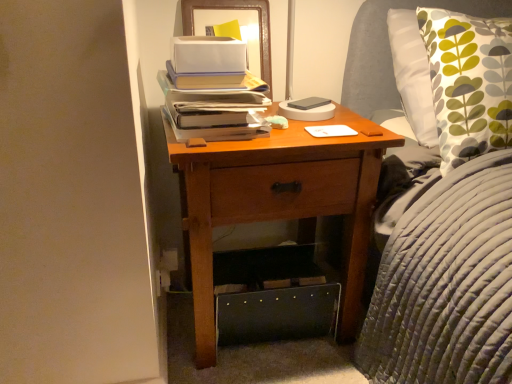
The image size is (512, 384). What do you see at coordinates (330, 131) in the screenshot?
I see `white matte notepad at center` at bounding box center [330, 131].

This screenshot has width=512, height=384. What do you see at coordinates (279, 202) in the screenshot?
I see `wooden nightstand at center` at bounding box center [279, 202].

The height and width of the screenshot is (384, 512). Find the location of `wooden nightstand at center`. wooden nightstand at center is located at coordinates (279, 202).

Find the location of a particular element. matte paper stack of books at center is located at coordinates (215, 108).

The image size is (512, 384). I want to click on white matte notepad at center, so click(330, 131).

Locate an element on the screen. picture frame on the right side of matte paper stack of books at center is located at coordinates (230, 19).

In the scene shown: Is wooden framed picture at upper center to the left or to the right of matte paper stack of books at center in the image?

From the image, it's evident that wooden framed picture at upper center is to the right of matte paper stack of books at center.

Which of these two, wooden framed picture at upper center or matte paper stack of books at center, is bigger?

With larger size is matte paper stack of books at center.

From the image's perspective, is wooden framed picture at upper center positioned above or below matte paper stack of books at center?

From the image's perspective, wooden framed picture at upper center appears above matte paper stack of books at center.

Is matte paper stack of books at center with wooden framed picture at upper center?

matte paper stack of books at center and wooden framed picture at upper center are not in contact.

How different are the orientations of matte paper stack of books at center and wooden framed picture at upper center in degrees?

They differ by 1.83 degrees in their facing directions.

Who is shorter, matte paper stack of books at center or wooden framed picture at upper center?

matte paper stack of books at center.

Is matte paper stack of books at center bigger than wooden nightstand at center?

Actually, matte paper stack of books at center might be smaller than wooden nightstand at center.

Is point (215, 134) in front of point (325, 121)?

Yes, it is in front of point (325, 121).

Is matte paper stack of books at center next to wooden nightstand at center?

They are not placed beside each other.

Is wooden framed picture at upper center positioned far away from white matte notepad at center?

No, wooden framed picture at upper center is not far from white matte notepad at center.

At what (x,y) coordinates should I click in order to perform the action: click on notepad on the right of wooden framed picture at upper center. Please return your answer as a coordinate pair (x, y). The width and height of the screenshot is (512, 384). Looking at the image, I should click on (330, 131).

From the image's perspective, who appears lower, wooden framed picture at upper center or white matte notepad at center?

white matte notepad at center appears lower in the image.

Is wooden framed picture at upper center behind white matte notepad at center?

Yes, wooden framed picture at upper center is further from the camera.

Considering the relative sizes of matte paper stack of books at center and white matte notepad at center in the image provided, is matte paper stack of books at center taller than white matte notepad at center?

Indeed, matte paper stack of books at center has a greater height compared to white matte notepad at center.

From a real-world perspective, is matte paper stack of books at center on white matte notepad at center?

Yes, from a real-world perspective, matte paper stack of books at center is on top of white matte notepad at center.

Consider the image. Is matte paper stack of books at center far from white matte notepad at center?

No, matte paper stack of books at center is not far away from white matte notepad at center.

From the image's perspective, between matte paper stack of books at center and white matte notepad at center, who is located below?

white matte notepad at center.

Is wooden nightstand at center facing towards white matte notepad at center?

No, wooden nightstand at center is not oriented towards white matte notepad at center.

Considering the relative positions of wooden nightstand at center and white matte notepad at center in the image provided, is wooden nightstand at center to the left of white matte notepad at center from the viewer's perspective?

Indeed, wooden nightstand at center is positioned on the left side of white matte notepad at center.

From the picture: Can you confirm if wooden nightstand at center is bigger than white matte notepad at center?

Yes, wooden nightstand at center is bigger than white matte notepad at center.

Can you tell me how much wooden nightstand at center and white matte notepad at center differ in facing direction?

The angular difference between wooden nightstand at center and white matte notepad at center is 1.83 degrees.

Between wooden nightstand at center and matte paper stack of books at center, which one appears on the left side from the viewer's perspective?

From the viewer's perspective, matte paper stack of books at center appears more on the left side.

From a real-world perspective, is wooden nightstand at center above or below matte paper stack of books at center?

Clearly, from a real-world perspective, wooden nightstand at center is below matte paper stack of books at center.

Between wooden nightstand at center and matte paper stack of books at center, which one has smaller width?

Thinner between the two is matte paper stack of books at center.

Is wooden nightstand at center closer to camera compared to matte paper stack of books at center?

Yes, it is in front of matte paper stack of books at center.

You are a GUI agent. You are given a task and a screenshot of the screen. Output one action in this format:
    pyautogui.click(x=<x>, y=<y>)
    Task: Click on the picture frame located on the right of matte paper stack of books at center
    The width and height of the screenshot is (512, 384).
    Given the screenshot: What is the action you would take?
    pyautogui.click(x=230, y=19)

Where is `picture frame above the matte paper stack of books at center (from the image's perspective)`? This screenshot has height=384, width=512. picture frame above the matte paper stack of books at center (from the image's perspective) is located at coordinates (230, 19).

Based on their spatial positions, is wooden nightstand at center or wooden framed picture at upper center further from white matte notepad at center?

Among the two, wooden framed picture at upper center is located further to white matte notepad at center.

Estimate the real-world distances between objects in this image. Which object is further from matte paper stack of books at center, wooden framed picture at upper center or white matte notepad at center?

Based on the image, wooden framed picture at upper center appears to be further to matte paper stack of books at center.

From the image, which object appears to be farther from matte paper stack of books at center, wooden nightstand at center or white matte notepad at center?

Among the two, white matte notepad at center is located further to matte paper stack of books at center.

Consider the image. Estimate the real-world distances between objects in this image. Which object is closer to white matte notepad at center, wooden nightstand at center or matte paper stack of books at center?

Based on the image, wooden nightstand at center appears to be nearer to white matte notepad at center.

Estimate the real-world distances between objects in this image. Which object is further from matte paper stack of books at center, wooden nightstand at center or wooden framed picture at upper center?

The object further to matte paper stack of books at center is wooden framed picture at upper center.

Considering their positions, is white matte notepad at center positioned further to matte paper stack of books at center than wooden framed picture at upper center?

wooden framed picture at upper center lies further to matte paper stack of books at center than the other object.

When comparing their distances from wooden framed picture at upper center, does matte paper stack of books at center or wooden nightstand at center seem further?

wooden nightstand at center.

Looking at the image, which one is located closer to wooden nightstand at center, white matte notepad at center or matte paper stack of books at center?

matte paper stack of books at center is closer to wooden nightstand at center.

Where is `book that lies between wooden framed picture at upper center and wooden nightstand at center from top to bottom`? This screenshot has height=384, width=512. book that lies between wooden framed picture at upper center and wooden nightstand at center from top to bottom is located at coordinates (215, 108).

In order to click on notepad that lies between matte paper stack of books at center and wooden nightstand at center from top to bottom in this screenshot , I will do `click(330, 131)`.

Locate an element on the screen. The image size is (512, 384). notepad between wooden framed picture at upper center and wooden nightstand at center vertically is located at coordinates (330, 131).

This screenshot has width=512, height=384. Find the location of `picture frame between matte paper stack of books at center and white matte notepad at center`. picture frame between matte paper stack of books at center and white matte notepad at center is located at coordinates (230, 19).